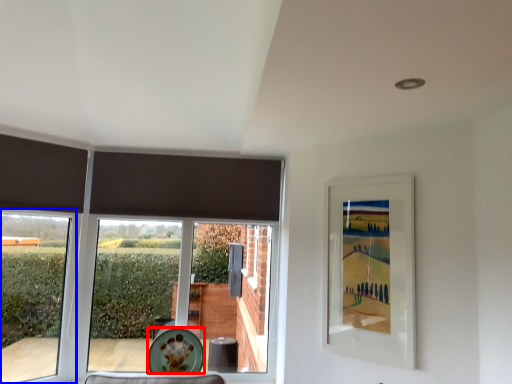
Question: Which point is closer to the camera, plate (highlighted by a red box) or window (highlighted by a blue box)?

Choices:
 (A) plate
 (B) window

Answer: (B)